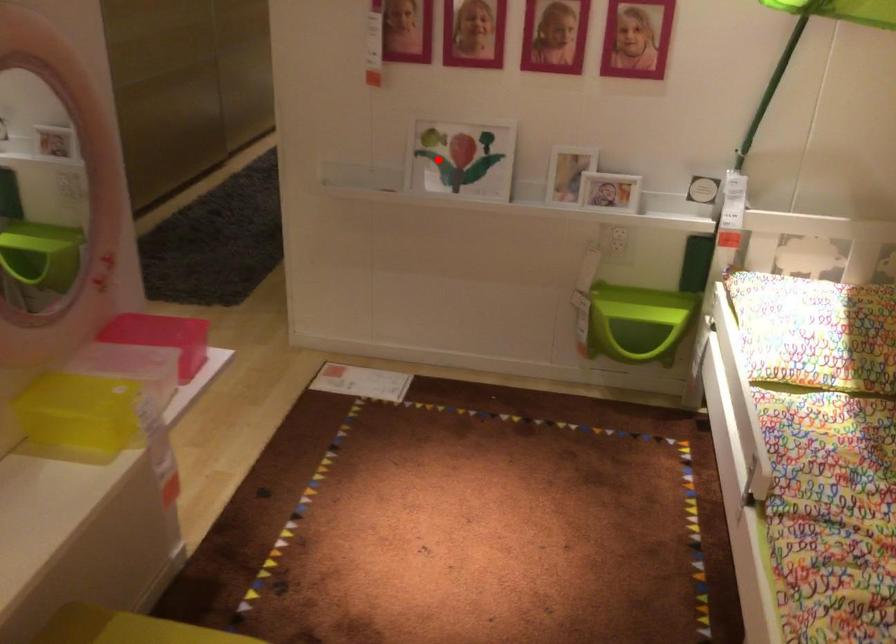
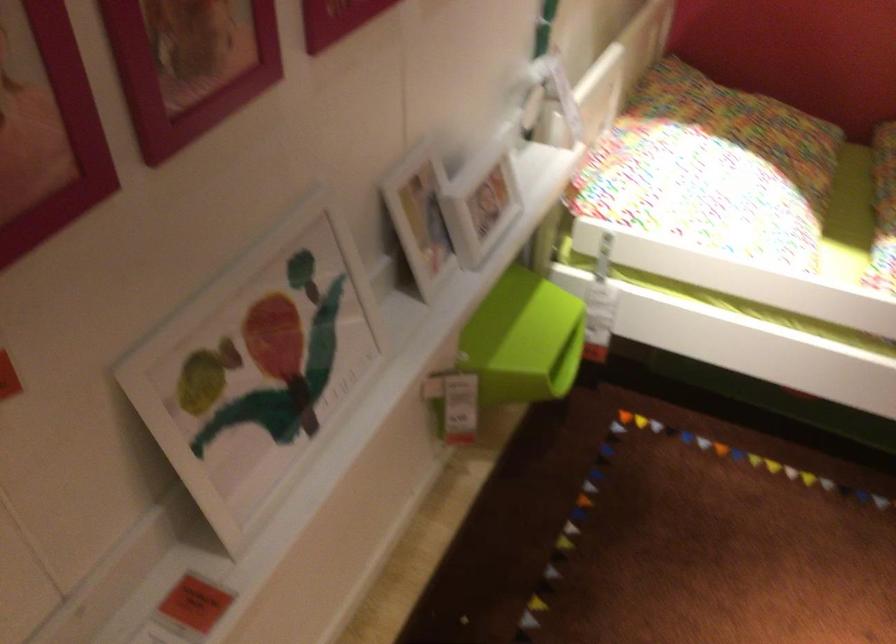
Question: I am providing you with two images of the same scene from different viewpoints. Image1 has a red point marked. In image2, the corresponding 3D location appears at what relative position? Reply with the corresponding letter.

Choices:
 (A) Closer
 (B) Farther

Answer: (A)